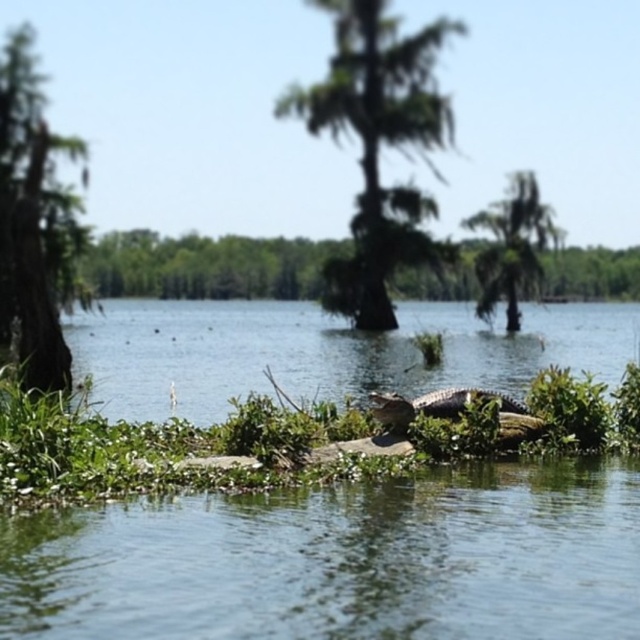
Is point (486, 257) positioned after point (404, 420)?

Yes, point (486, 257) is behind point (404, 420).

Is point (525, 273) positioned in front of point (449, 400)?

No, it is not.

What do you see at coordinates (513, 246) in the screenshot? This screenshot has height=640, width=640. I see `green leafy tree at upper right` at bounding box center [513, 246].

Where is `green leafy tree at upper right`? Image resolution: width=640 pixels, height=640 pixels. green leafy tree at upper right is located at coordinates pyautogui.click(x=513, y=246).

Does clear water at center lie in front of greenish water at center?

Yes, it is.

Is point (464, 564) positioned behind point (573, 356)?

No, it is in front of (573, 356).

Is point (241, 620) positioned behind point (260, 330)?

That is False.

Identify the location of clear water at center. (340, 561).

Is clear water at center in front of green leafy tree at center?

Yes.

Is clear water at center below green leafy tree at center?

Indeed, clear water at center is positioned under green leafy tree at center.

The height and width of the screenshot is (640, 640). Describe the element at coordinates (340, 561) in the screenshot. I see `clear water at center` at that location.

Locate an element on the screen. The height and width of the screenshot is (640, 640). clear water at center is located at coordinates (340, 561).